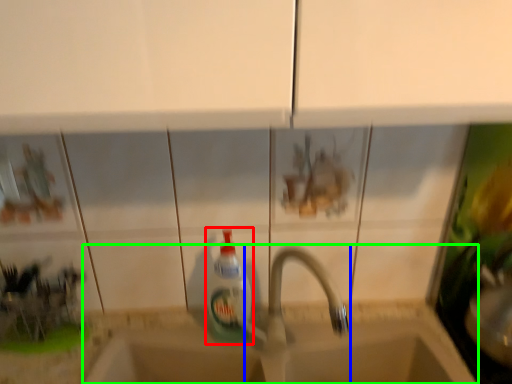
Question: Which object is positioned farthest from bottle (highlighted by a red box)? Select from tap (highlighted by a blue box) and sink (highlighted by a green box).

Choices:
 (A) tap
 (B) sink

Answer: (B)